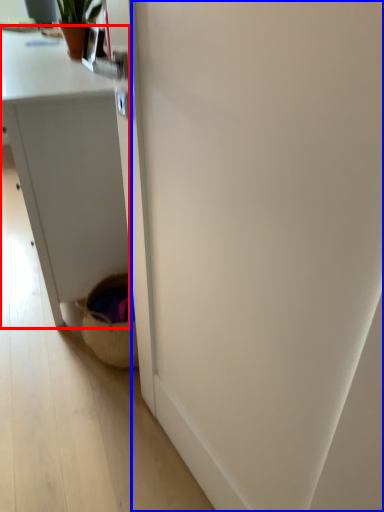
Question: Which of the following is the farthest to the observer, desk (highlighted by a red box) or screen door (highlighted by a blue box)?

Choices:
 (A) desk
 (B) screen door

Answer: (A)